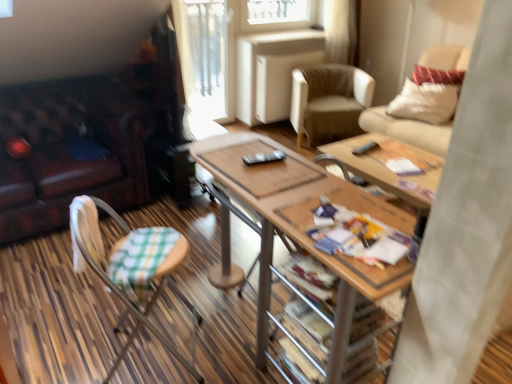
You are a GUI agent. You are given a task and a screenshot of the screen. Output one action in this format:
    pyautogui.click(x=<x>, y=<y>)
    Task: Click on the free location to the right of black plastic remote control at center, placed as the second remote control when sorted from left to right
    The image size is (512, 384).
    Given the screenshot: What is the action you would take?
    pyautogui.click(x=392, y=153)